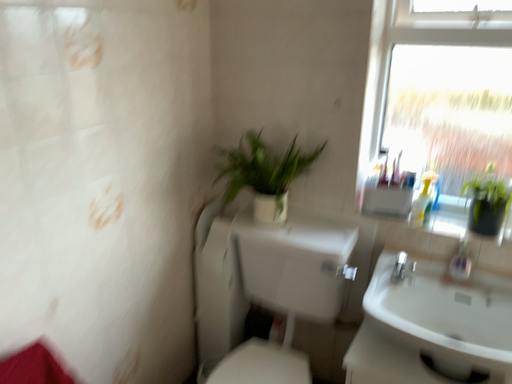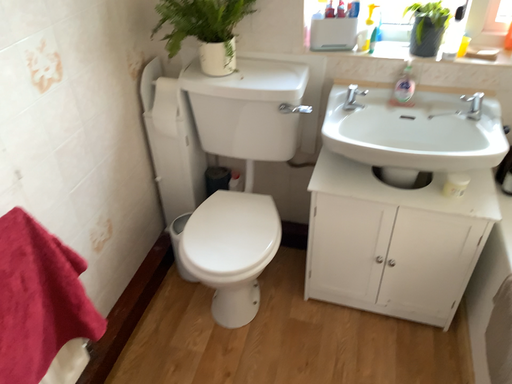
Question: How did the camera likely rotate when shooting the video?

Choices:
 (A) rotated upward
 (B) rotated downward

Answer: (B)